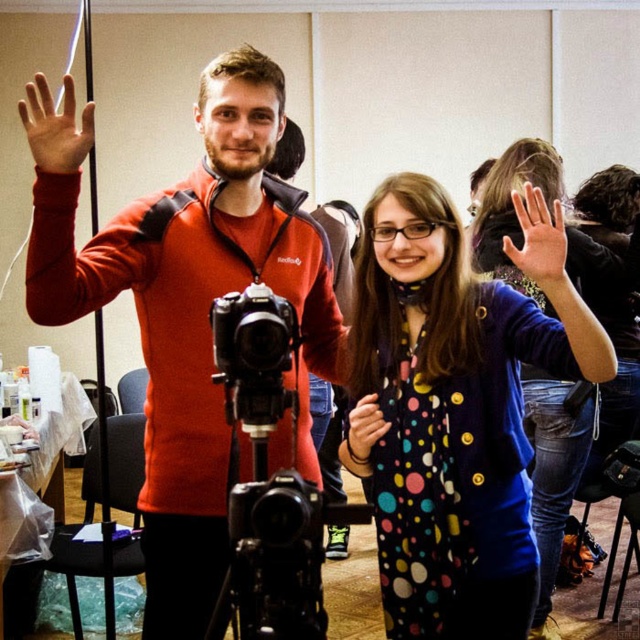
Question: Among these objects, which one is nearest to the camera?

Choices:
 (A) light brown skin at center
 (B) matte skin hand at upper left

Answer: (B)

Question: Does polka dot fabric dress at center come in front of light brown skin at center?

Choices:
 (A) yes
 (B) no

Answer: (B)

Question: Is black plastic tripod at center below matte skin hand at upper left?

Choices:
 (A) yes
 (B) no

Answer: (A)

Question: From the image, what is the correct spatial relationship of black plastic tripod at center in relation to light brown skin at center?

Choices:
 (A) left
 (B) right

Answer: (A)

Question: Which point is farther from the camera taking this photo?

Choices:
 (A) (534, 241)
 (B) (380, 435)
 (C) (320, 234)

Answer: (C)

Question: Which object is the closest to the polka dot fabric dress at center?

Choices:
 (A) matte skin hand at upper left
 (B) polka dot fabric hand at center
 (C) matte red jacket at center
 (D) light brown skin at center

Answer: (B)